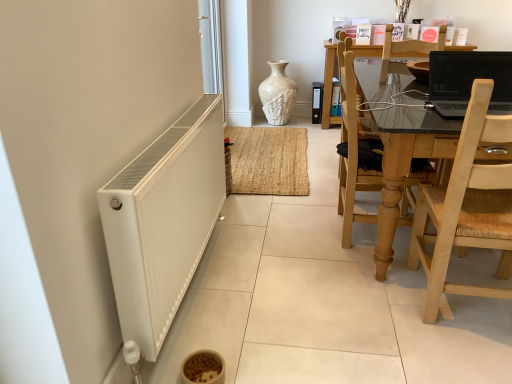
At what (x,y) coordinates should I click in order to perform the action: click on free area in between wooden chair at right, positioned as the first chair in back-to-front order, and white matte radiator at lower left. Please return your answer as a coordinate pair (x, y). The height and width of the screenshot is (384, 512). Looking at the image, I should click on (281, 270).